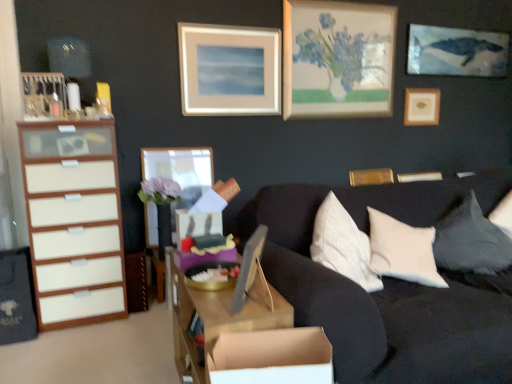
Question: Is wooden picture frame at upper right, which ranks as the 5th picture frame in left-to-right order, situated inside matte wooden picture frame at upper center, placed as the second picture frame when sorted from left to right, or outside?

Choices:
 (A) outside
 (B) inside

Answer: (A)

Question: Considering the positions of point (434, 89) and point (253, 38), is point (434, 89) closer or farther from the camera than point (253, 38)?

Choices:
 (A) closer
 (B) farther

Answer: (B)

Question: Which object is the farthest from the matte wooden picture frame at upper center, which is counted as the fourth picture frame, starting from the right?

Choices:
 (A) wooden picture frame at upper right, which ranks as the 5th picture frame in left-to-right order
 (B) wooden picture frame at center, the 1th picture frame from the front
 (C) dark gray fabric pillow at right
 (D) gold metallic picture frame at upper right, which is the 4th picture frame in front-to-back order
 (E) wooden picture frame at center, the fifth picture frame from the right

Answer: (B)

Question: Based on their relative distances, which object is nearer to the wooden picture frame at center, acting as the fourth picture frame starting from the back?

Choices:
 (A) dark gray fabric pillow at right
 (B) cardboard box at lower center
 (C) matte wooden picture frame at upper center, the third picture frame viewed from the back
 (D) gold metallic picture frame at upper right, which is counted as the second picture frame, starting from the back
 (E) wooden picture frame at center, the third picture frame positioned from the left

Answer: (C)